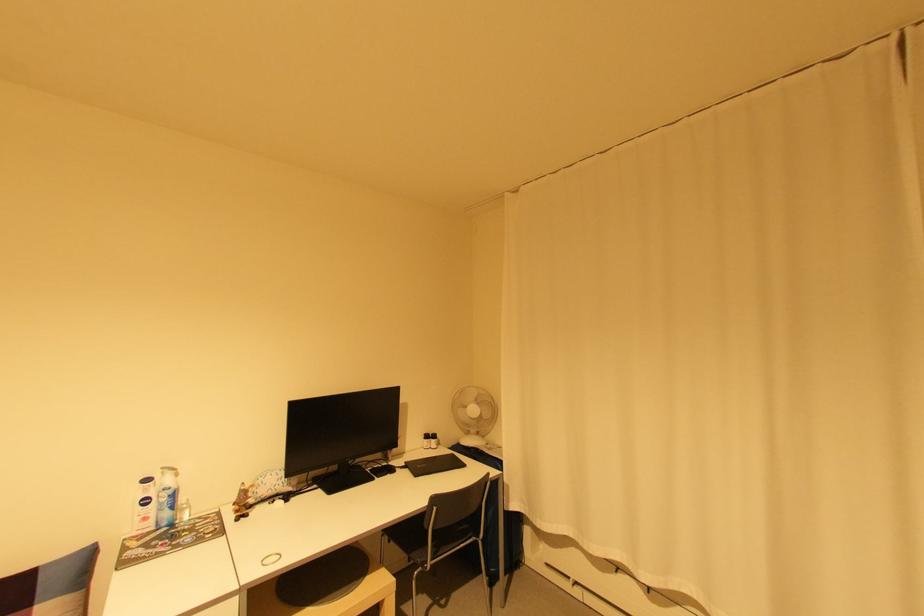
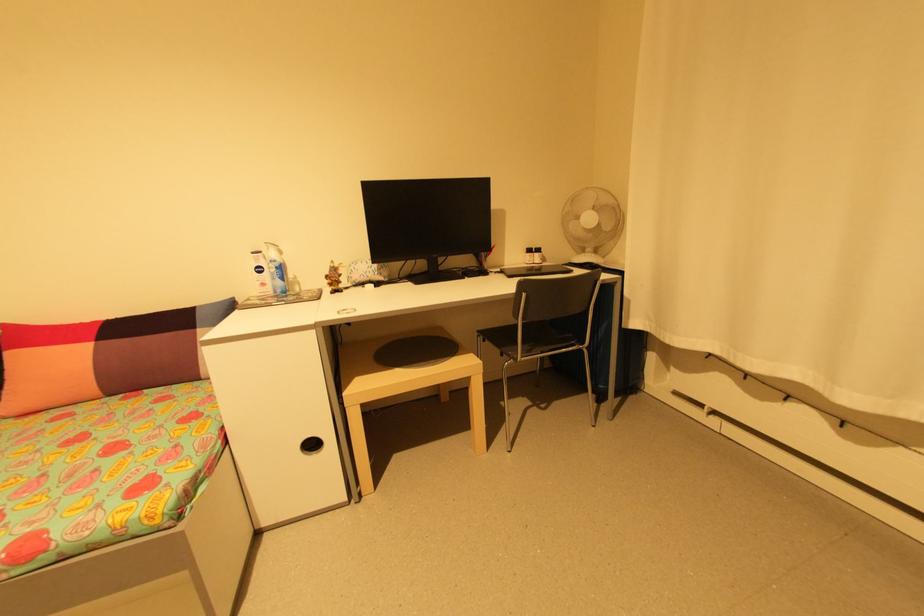
Find the pixel in the second image that matches point (480, 543) in the first image.

(585, 352)